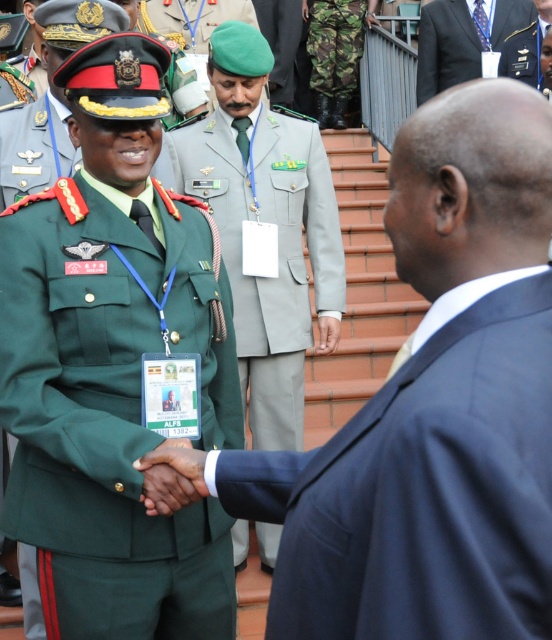
Is green uniform at left in front of green military uniform at center?

Yes, green uniform at left is in front of green military uniform at center.

Between point (416, 486) and point (530, 54), which one is positioned in front?

Point (416, 486) is in front.

Where is `green uniform at left`? The width and height of the screenshot is (552, 640). green uniform at left is located at coordinates click(417, 502).

Does point (204, 132) come closer to viewer compared to point (543, 1)?

Yes, it is.

Does point (278, 332) lie behind point (512, 60)?

No.

Identify the location of green fabric uniform at center. (277, 248).

The width and height of the screenshot is (552, 640). What are the coordinates of `green fabric uniform at center` in the screenshot? It's located at (277, 248).

Between green matte uniform at center and green military uniform at center, which one has more height?

Standing taller between the two is green matte uniform at center.

Does green matte uniform at center have a lesser width compared to green military uniform at center?

Incorrect, green matte uniform at center's width is not less than green military uniform at center's.

Find the location of a particular element. This screenshot has height=640, width=552. green matte uniform at center is located at coordinates (105, 371).